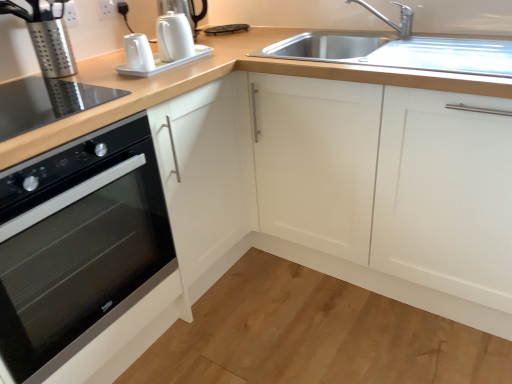
Question: Would you consider black glass oven at left to be distant from white glossy coffee machine at upper center, the 2th coffee machine positioned from the left?

Choices:
 (A) no
 (B) yes

Answer: (A)

Question: Can you confirm if black glass oven at left is bigger than white glossy coffee machine at upper center, the 1th coffee machine from the right?

Choices:
 (A) yes
 (B) no

Answer: (A)

Question: Does black glass oven at left appear on the right side of white glossy coffee machine at upper center, the 2th coffee machine positioned from the left?

Choices:
 (A) yes
 (B) no

Answer: (B)

Question: Is the position of black glass oven at left less distant than that of white glossy coffee machine at upper center, the 1th coffee machine from the right?

Choices:
 (A) no
 (B) yes

Answer: (B)

Question: From the image's perspective, does black glass oven at left appear lower than white glossy coffee machine at upper center, the 1th coffee machine from the right?

Choices:
 (A) no
 (B) yes

Answer: (B)

Question: In terms of height, does smooth wood floor at lower center look taller or shorter compared to white glossy kettle at upper center, the third appliance when ordered from bottom to top?

Choices:
 (A) short
 (B) tall

Answer: (A)

Question: From a real-world perspective, is smooth wood floor at lower center physically located above or below white glossy kettle at upper center, which appears as the 2th appliance when viewed from the top?

Choices:
 (A) below
 (B) above

Answer: (A)

Question: Is smooth wood floor at lower center in front of or behind white glossy kettle at upper center, which appears as the 2th appliance when viewed from the top, in the image?

Choices:
 (A) behind
 (B) front

Answer: (B)

Question: Is point (290, 374) closer or farther from the camera than point (164, 67)?

Choices:
 (A) closer
 (B) farther

Answer: (A)

Question: Would you say white glossy electric kettle at upper center, which is counted as the 4th appliance, starting from the bottom, is inside or outside white matte cabinet at upper right?

Choices:
 (A) inside
 (B) outside

Answer: (B)

Question: Is white glossy electric kettle at upper center, which is counted as the first appliance, starting from the top, taller or shorter than white matte cabinet at upper right?

Choices:
 (A) tall
 (B) short

Answer: (B)

Question: Considering their positions, is white glossy electric kettle at upper center, which is counted as the 4th appliance, starting from the bottom, located in front of or behind white matte cabinet at upper right?

Choices:
 (A) front
 (B) behind

Answer: (B)

Question: From the image's perspective, is white glossy electric kettle at upper center, which is counted as the first appliance, starting from the top, positioned above or below white matte cabinet at upper right?

Choices:
 (A) above
 (B) below

Answer: (A)

Question: Considering the positions of black glass cooktop at lower left, the first appliance in the bottom-to-top sequence, and silver metallic faucet at upper right in the image, is black glass cooktop at lower left, the first appliance in the bottom-to-top sequence, taller or shorter than silver metallic faucet at upper right?

Choices:
 (A) short
 (B) tall

Answer: (A)

Question: In the image, is black glass cooktop at lower left, the first appliance in the bottom-to-top sequence, positioned in front of or behind silver metallic faucet at upper right?

Choices:
 (A) behind
 (B) front

Answer: (B)